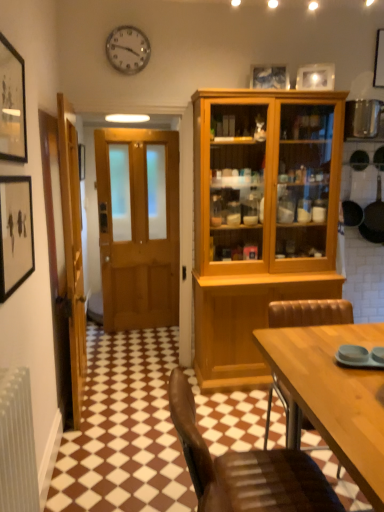
The width and height of the screenshot is (384, 512). I want to click on free spot below brown wooden door at center, the 1th door in the right-to-left sequence (from a real-world perspective), so click(x=146, y=366).